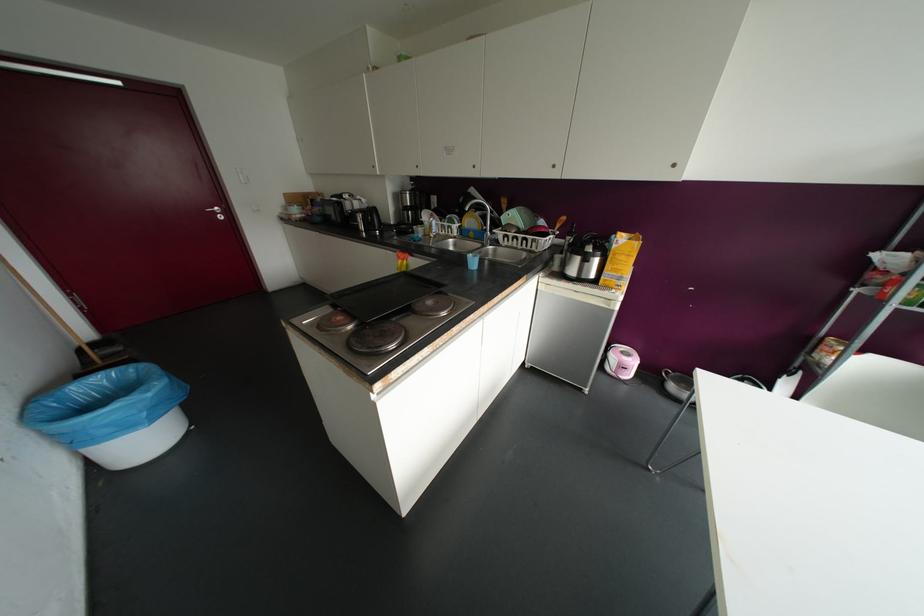
The width and height of the screenshot is (924, 616). What are the coordinates of `silver door handle` in the screenshot? It's located at (214, 209).